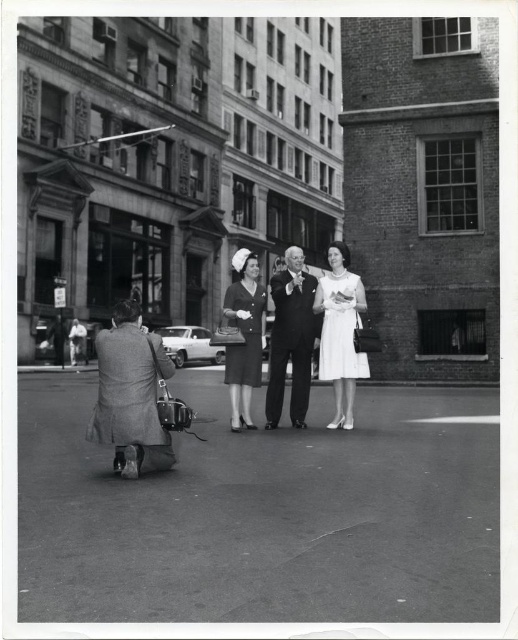
You are a fashion historian examining this historical photograph. You notice two dresses in the scene. The first is a white satin dress at center, and the second is a matte black dress at center. Which dress is positioned higher in the image?

The white satin dress at center is located above the matte black dress at center, so the white satin dress at center is positioned higher in the image.